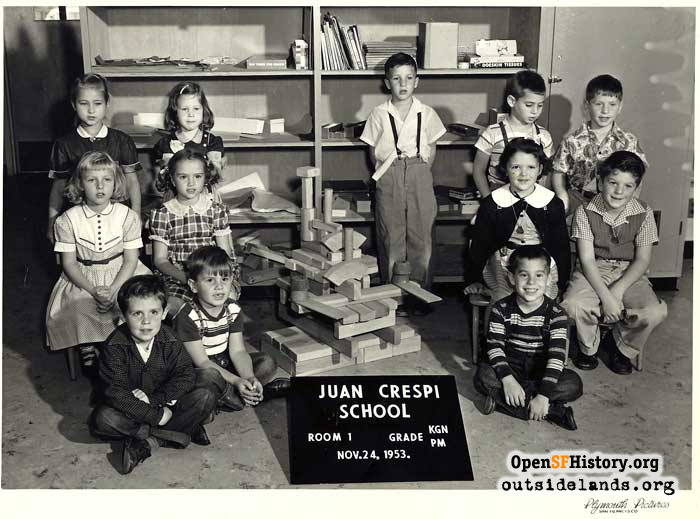
You are a GUI agent. You are given a task and a screenshot of the screen. Output one action in this format:
    pyautogui.click(x=<x>, y=<y>)
    Task: Click on the bookshel
    The height and width of the screenshot is (519, 700).
    Given the screenshot: What is the action you would take?
    pyautogui.click(x=311, y=122)